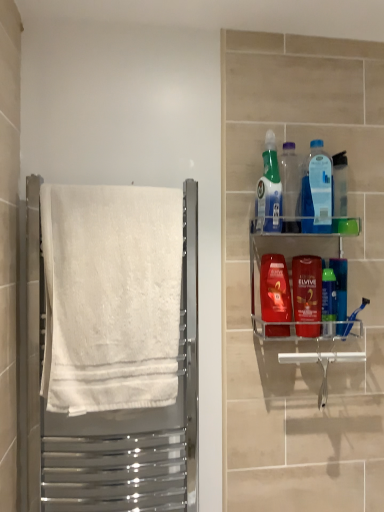
Question: Is green plastic mouthwash at right, the third mouthwash positioned from the left, in front of or behind translucent plastic spray bottle at upper right, which appears as the 1th cleaning product when viewed from the left, in the image?

Choices:
 (A) front
 (B) behind

Answer: (B)

Question: Would you say green plastic mouthwash at right, which is the 2th mouthwash in right-to-left order, is inside or outside translucent plastic spray bottle at upper right, which is counted as the 2th cleaning product, starting from the right?

Choices:
 (A) inside
 (B) outside

Answer: (B)

Question: Which object is positioned closest to the translucent blue mouthwash at center right, which is the 1th mouthwash from left to right?

Choices:
 (A) clear acrylic shelf at upper right
 (B) transparent plastic bottle at upper center, the 1th bottle in the left-to-right sequence
 (C) white cotton towel at left
 (D) translucent plastic mouthwash at center right, which is the third mouthwash from right to left
 (E) translucent plastic spray bottle at upper right, which is counted as the 2th cleaning product, starting from the right

Answer: (D)

Question: Which of these objects is positioned closest to the blue plastic bottle at upper right, positioned as the first cleaning product in right-to-left order?

Choices:
 (A) translucent blue mouthwash at center right, marked as the fourth mouthwash in a right-to-left arrangement
 (B) transparent plastic bottle at upper center, the 1th bottle in the left-to-right sequence
 (C) green plastic mouthwash at right, which is the 4th mouthwash in left-to-right order
 (D) translucent plastic spray bottle at upper right, which appears as the 1th cleaning product when viewed from the left
 (E) green plastic mouthwash at right, which is the 2th mouthwash in right-to-left order

Answer: (B)